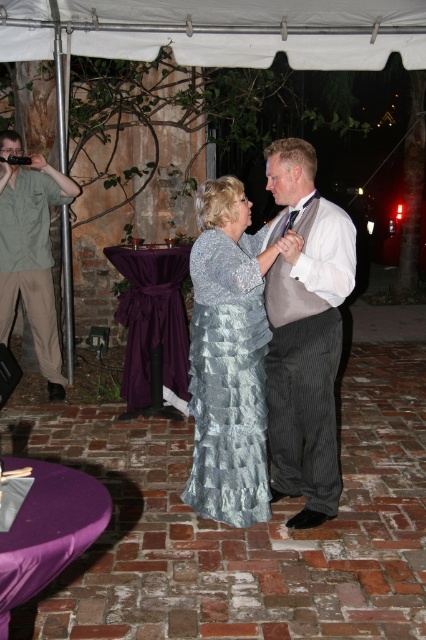
You are a photographer at a wedding reception. You need to capture a photo of the shiny silver dress at center without the white fabric canopy at upper center casting a shadow on it. What adjustment should you make to the camera setup?

The white fabric canopy at upper center is located above the shiny silver dress at center, so to avoid casting a shadow, you should position the camera light source below the dress or adjust the angle so the canopy does not block the light onto the dress.

You are a photographer at the event and want to capture a photo of the shiny silver dress at center and the green shirt at left. Which object should you focus on first if you want to highlight the smaller one?

The shiny silver dress at center has a smaller size compared to the green shirt at left, so you should focus on the shiny silver dress at center first to highlight its smaller size.

You are planning to set up a 3.5 meter long table under the white fabric canopy at upper center for a buffet. Can the table fit under the canopy without extending beyond its edges?

The distance between them is 4.25 meters, so yes, the 3.5 meter long table can fit under the white fabric canopy at upper center as it is shorter than the available space.